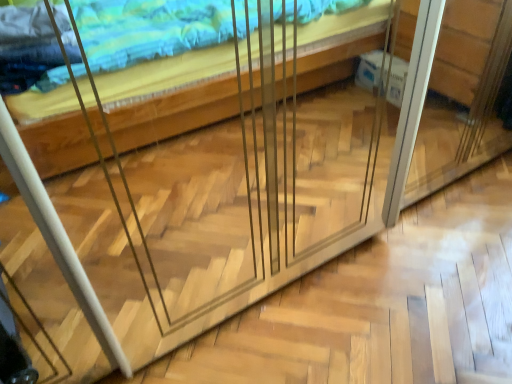
The height and width of the screenshot is (384, 512). What do you see at coordinates (192, 222) in the screenshot?
I see `wooden at center` at bounding box center [192, 222].

What are the coordinates of `wooden at center` in the screenshot? It's located at (192, 222).

Identify the location of wooden at center. This screenshot has height=384, width=512. (192, 222).